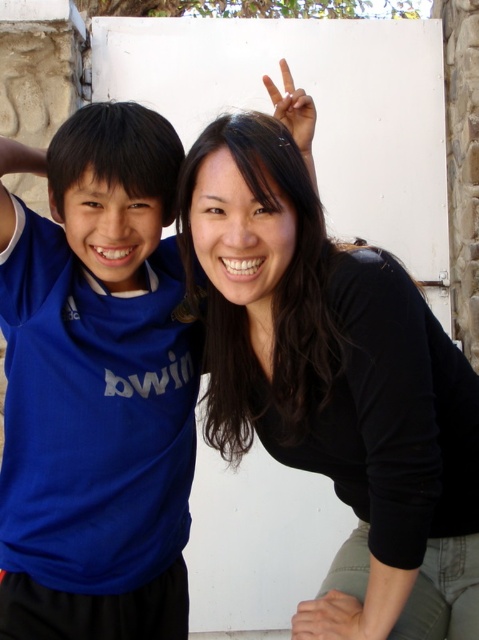
Question: Does black matte shirt at center appear over smooth skin hand at lower center?

Choices:
 (A) yes
 (B) no

Answer: (A)

Question: Which point is closer to the camera?

Choices:
 (A) white matte hand at upper center
 (B) black matte shirt at center
 (C) blue fabric shirt at left

Answer: (B)

Question: Is the position of blue fabric shirt at left more distant than that of black matte shirt at center?

Choices:
 (A) no
 (B) yes

Answer: (B)

Question: Does black matte shirt at center come behind smooth skin hand at lower center?

Choices:
 (A) yes
 (B) no

Answer: (B)

Question: Which of these objects is positioned farthest from the white matte hand at upper center?

Choices:
 (A) black matte shirt at center
 (B) smooth skin hand at lower center
 (C) blue fabric shirt at left

Answer: (B)

Question: Among these points, which one is nearest to the camera?

Choices:
 (A) (181, 529)
 (B) (287, 74)
 (C) (283, 332)
 (D) (324, 600)

Answer: (C)